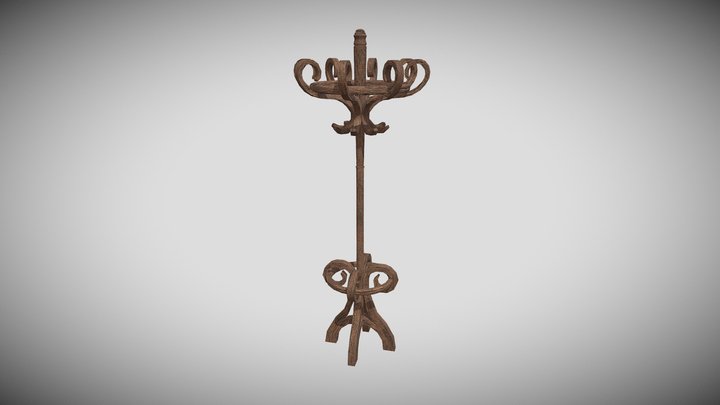
This screenshot has height=405, width=720. What are the coordinates of `the top of coat rack` in the screenshot? It's located at (358, 33).